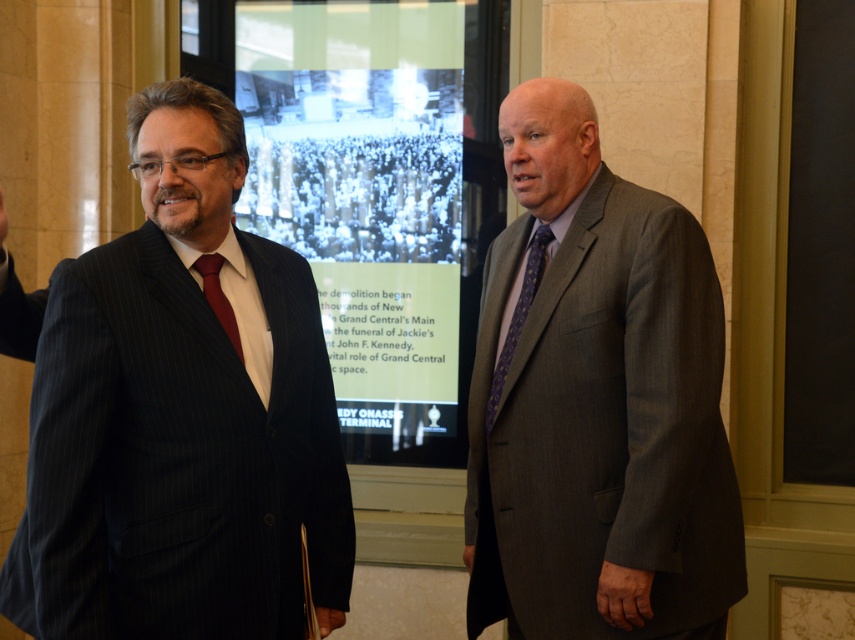
Can you confirm if gray pinstripe suit at right is shorter than purple textured tie at right?

No.

Between point (687, 301) and point (532, 282), which one is positioned in front?

Point (687, 301)

In order to click on gray pinstripe suit at right in this screenshot , I will do tap(596, 401).

Is point (850, 10) farther from camera compared to point (208, 285)?

Yes, it is behind point (208, 285).

The image size is (855, 640). In order to click on blackboard at right in this screenshot , I will do 820,250.

What are the coordinates of `blackboard at right` in the screenshot? It's located at (820, 250).

Is matte black suit at left to the right of gray pinstripe suit at right from the viewer's perspective?

Incorrect, matte black suit at left is not on the right side of gray pinstripe suit at right.

Does matte black suit at left have a smaller size compared to gray pinstripe suit at right?

Yes, matte black suit at left is smaller than gray pinstripe suit at right.

Is point (57, 636) farther from camera compared to point (540, 244)?

No, (57, 636) is in front of (540, 244).

The height and width of the screenshot is (640, 855). Identify the location of matte black suit at left. (180, 417).